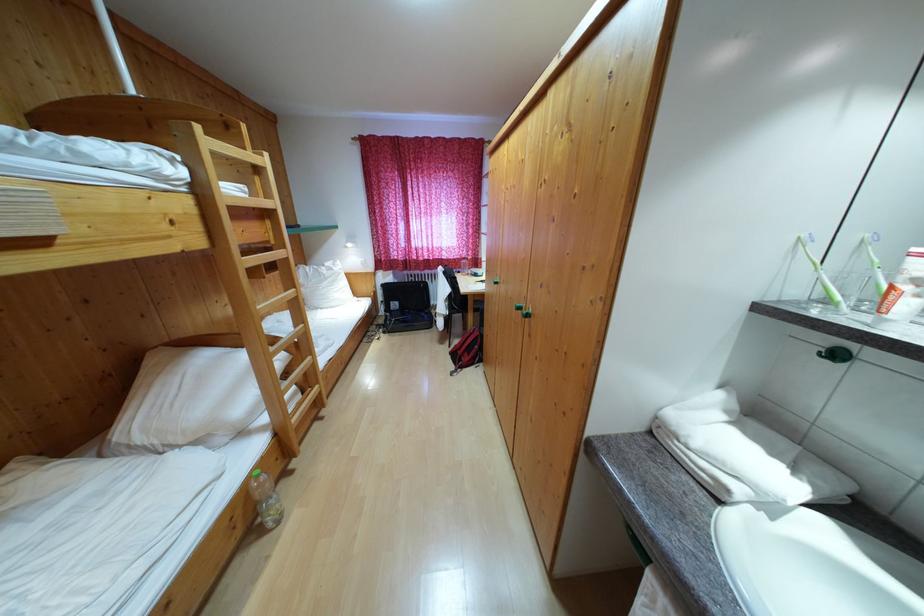
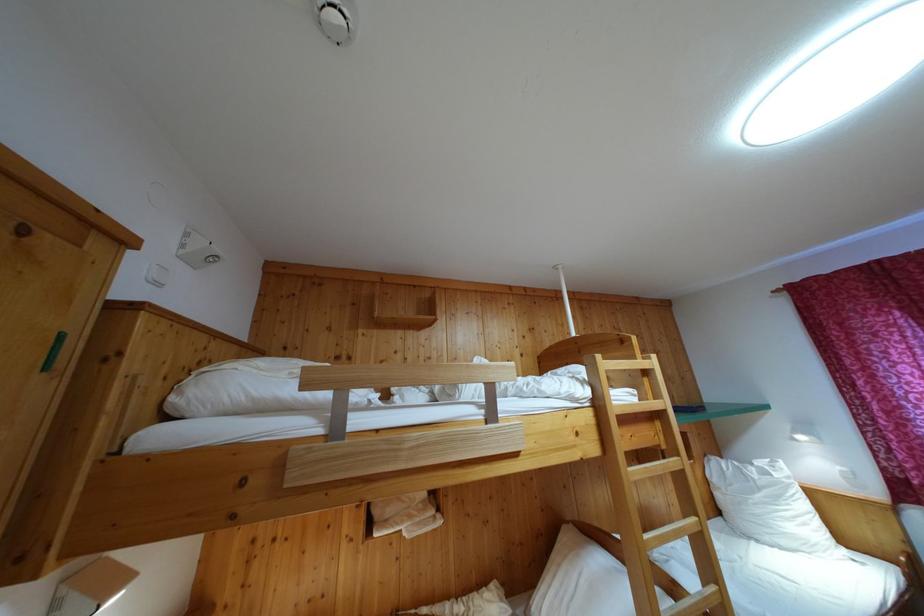
Based on the continuous images, in which direction is the camera rotating?

The rotation direction of the camera is left-up.